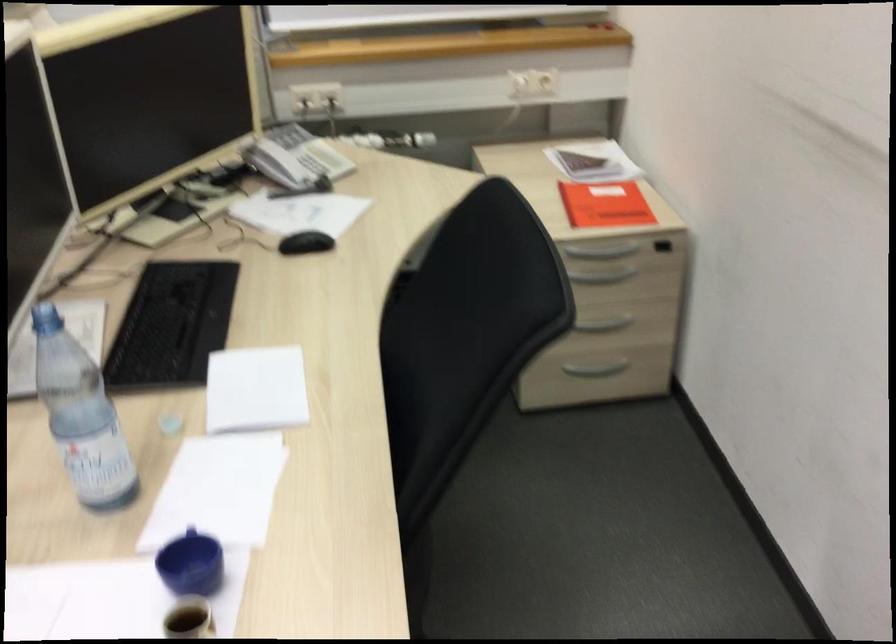
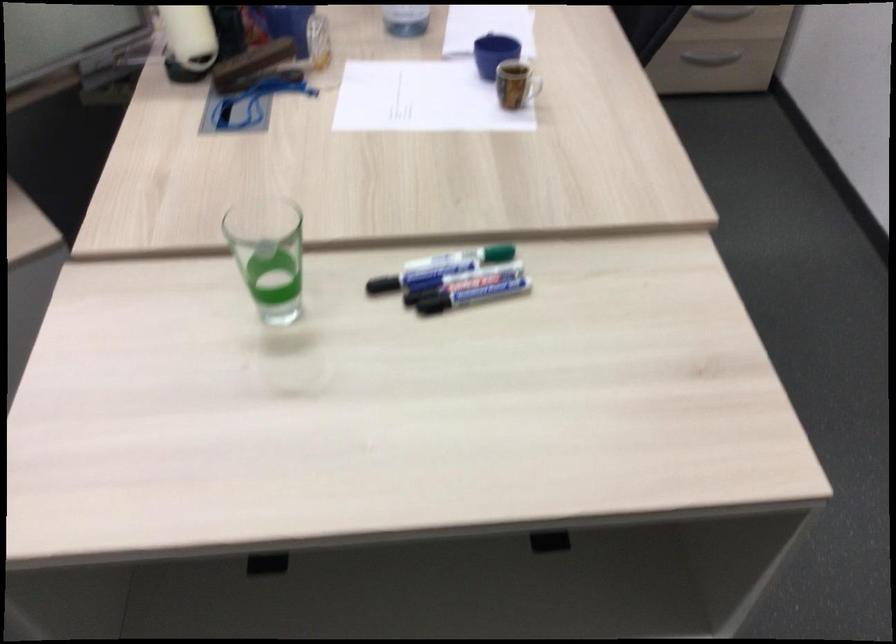
In the second image, find the point that corresponds to (216,545) in the first image.

(494, 53)